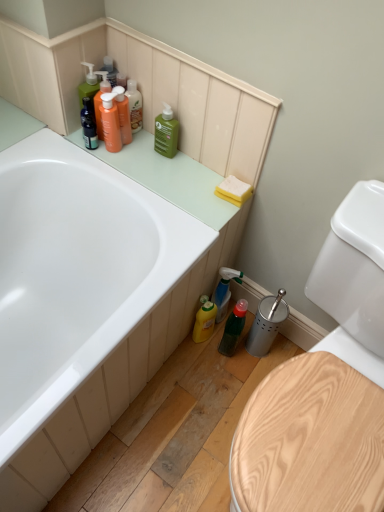
Question: Would you say translucent orange bottle at upper left, which ranks as the first cleaning product in left-to-right order, contains yellow matte bottle at lower center, the 1th cleaning product from the bottom?

Choices:
 (A) no
 (B) yes

Answer: (A)

Question: Is translucent orange bottle at upper left, acting as the 4th cleaning product starting from the bottom, not close to yellow matte bottle at lower center, which ranks as the fourth cleaning product in top-to-bottom order?

Choices:
 (A) no
 (B) yes

Answer: (A)

Question: From the image's perspective, is translucent orange bottle at upper left, the 1th cleaning product from the top, located above yellow matte bottle at lower center, the 3th cleaning product in the left-to-right sequence?

Choices:
 (A) no
 (B) yes

Answer: (B)

Question: Does translucent orange bottle at upper left, which ranks as the first cleaning product in left-to-right order, have a larger size compared to yellow matte bottle at lower center, the second cleaning product positioned from the right?

Choices:
 (A) no
 (B) yes

Answer: (A)

Question: Is translucent orange bottle at upper left, which ranks as the first cleaning product in left-to-right order, further to camera compared to yellow matte bottle at lower center, the 3th cleaning product in the left-to-right sequence?

Choices:
 (A) no
 (B) yes

Answer: (A)

Question: Is translucent orange bottle at upper left, acting as the 4th cleaning product starting from the bottom, thinner than yellow matte bottle at lower center, the 1th cleaning product from the bottom?

Choices:
 (A) yes
 (B) no

Answer: (A)

Question: Does wooden toilet seat at lower right have a lesser height compared to translucent orange bottles at upper left, arranged as the 1th toiletry when ordered from the bottom?

Choices:
 (A) yes
 (B) no

Answer: (B)

Question: Can you confirm if wooden toilet seat at lower right is bigger than translucent orange bottles at upper left, which ranks as the second toiletry in top-to-bottom order?

Choices:
 (A) yes
 (B) no

Answer: (A)

Question: Does wooden toilet seat at lower right have a smaller size compared to translucent orange bottles at upper left, which ranks as the second toiletry in top-to-bottom order?

Choices:
 (A) no
 (B) yes

Answer: (A)

Question: Is wooden toilet seat at lower right touching translucent orange bottles at upper left, arranged as the 1th toiletry when ordered from the bottom?

Choices:
 (A) no
 (B) yes

Answer: (A)

Question: Is wooden toilet seat at lower right to the left of translucent orange bottles at upper left, which ranks as the second toiletry in top-to-bottom order, from the viewer's perspective?

Choices:
 (A) no
 (B) yes

Answer: (A)

Question: Is translucent orange bottles at upper left, which ranks as the second toiletry in top-to-bottom order, inside wooden toilet seat at lower right?

Choices:
 (A) no
 (B) yes

Answer: (A)

Question: Is green matte bottle at upper center, which ranks as the third cleaning product in right-to-left order, at the left side of wooden toilet seat at lower right?

Choices:
 (A) yes
 (B) no

Answer: (A)